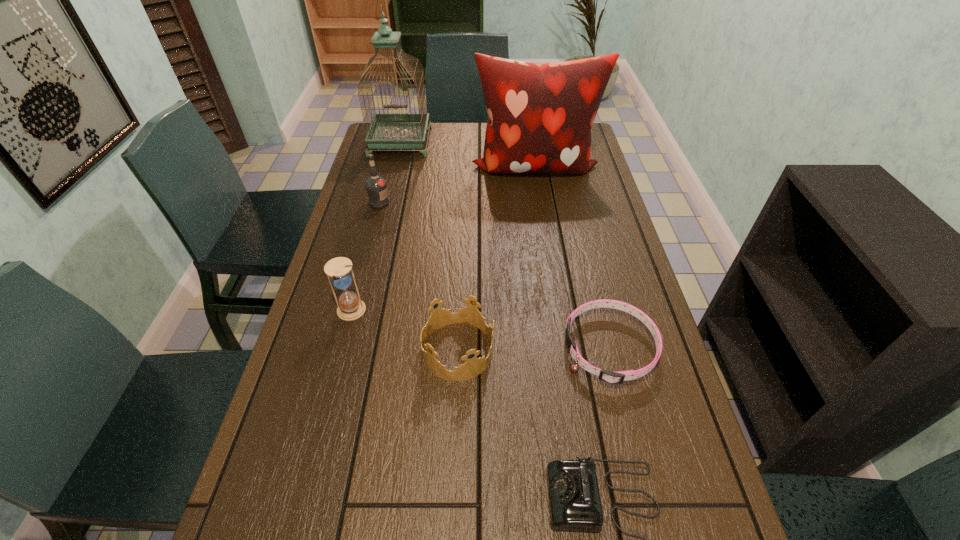
This screenshot has width=960, height=540. I want to click on free spot between the tallest object and the hourglass, so click(375, 227).

This screenshot has height=540, width=960. I want to click on object that stands as the fifth closest to the second tallest object, so click(x=470, y=315).

Locate an element on the screen. This screenshot has width=960, height=540. object that is the fifth nearest to the fifth nearest object is located at coordinates (617, 377).

At what (x,y) coordinates should I click in order to perform the action: click on vacant region that satisfies the following two spatial constraints: 1. on the front-facing side of the second tallest object; 2. on the front label of the third farthest object. Please return your answer as a coordinate pair (x, y). Looking at the image, I should click on (540, 202).